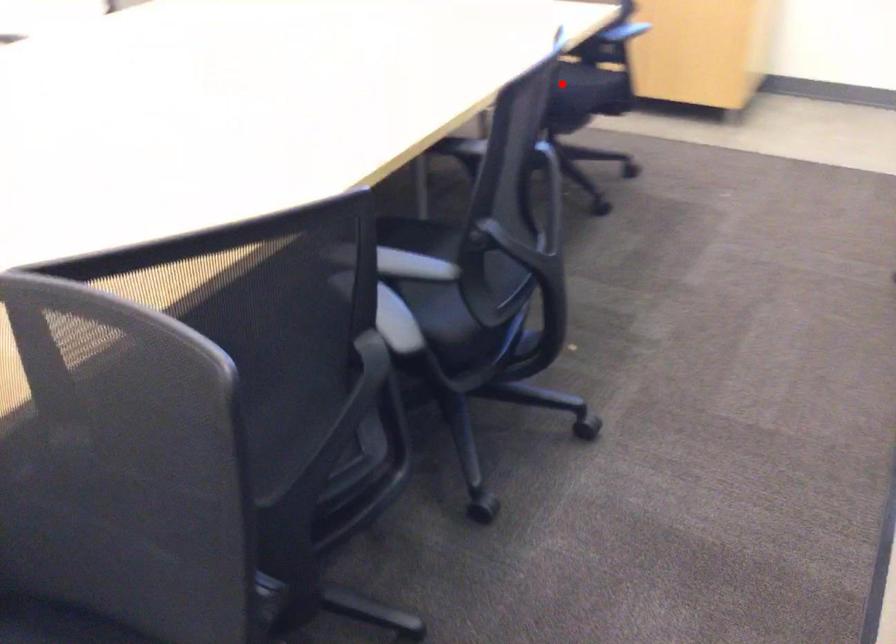
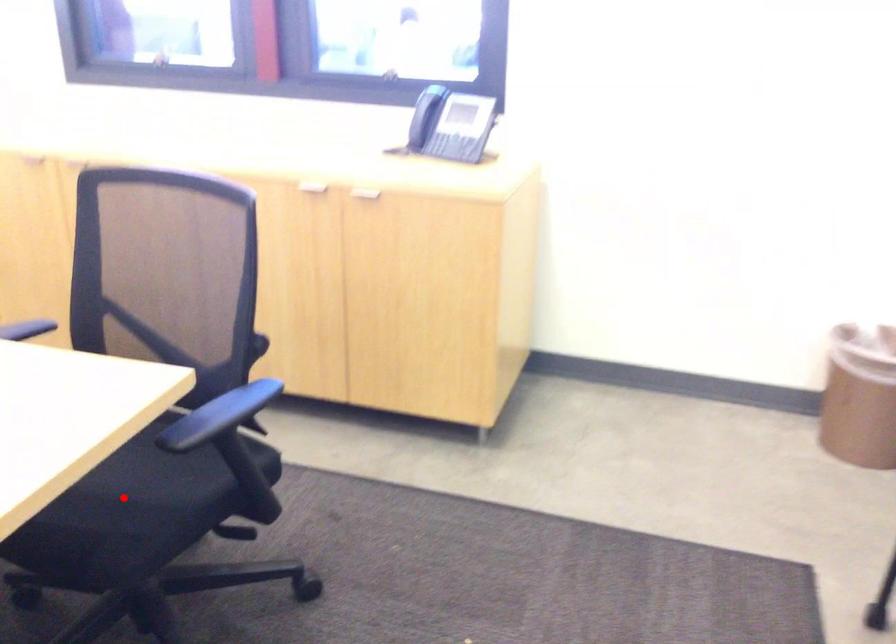
From the picture: I am providing you with two images of the same scene from different viewpoints. A red point is marked on the first image and another point is marked on the second image. Are the points marked in image1 and image2 representing the same 3D position?

Yes